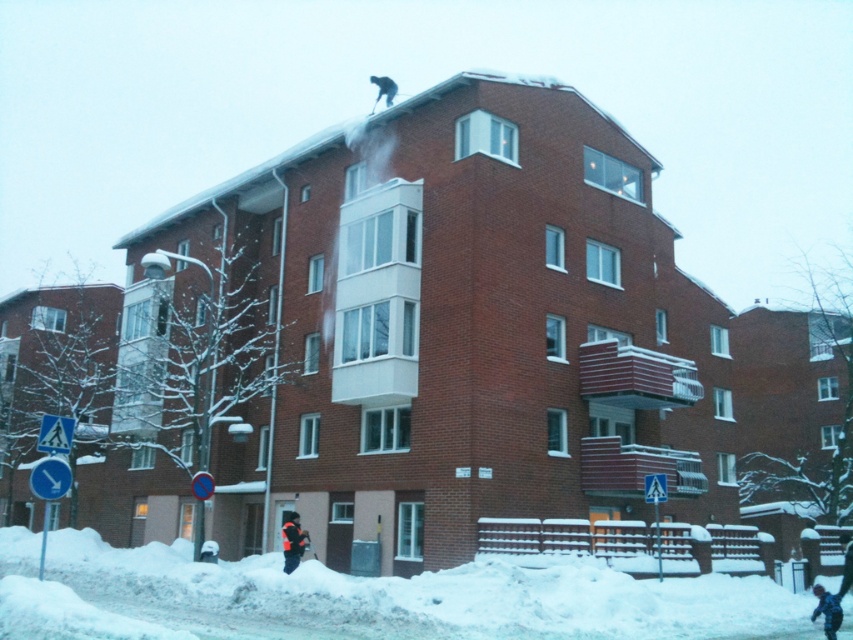
Is white plastic triangle at lower left further to the viewer compared to blue plastic pedestrian crossing sign at lower center?

That is False.

Can you confirm if white plastic triangle at lower left is wider than blue plastic pedestrian crossing sign at lower center?

Indeed, white plastic triangle at lower left has a greater width compared to blue plastic pedestrian crossing sign at lower center.

Is point (51, 445) farther from viewer compared to point (659, 577)?

No, it is in front of (659, 577).

The height and width of the screenshot is (640, 853). Identify the location of white plastic triangle at lower left. (55, 433).

Can you confirm if orange fleece jacket at upper center is smaller than blue plastic pedestrian crossing sign at lower center?

Yes, orange fleece jacket at upper center is smaller than blue plastic pedestrian crossing sign at lower center.

How far apart are orange fleece jacket at upper center and blue plastic pedestrian crossing sign at lower center?

A distance of 16.61 meters exists between orange fleece jacket at upper center and blue plastic pedestrian crossing sign at lower center.

Who is more forward, (289, 531) or (654, 520)?

Positioned in front is point (289, 531).

This screenshot has height=640, width=853. Find the location of `orange fleece jacket at upper center`. orange fleece jacket at upper center is located at coordinates (292, 541).

Can you confirm if white fluffy snow at lower center is shorter than blue fabric jacket at lower right?

In fact, white fluffy snow at lower center may be taller than blue fabric jacket at lower right.

Which of these two, white fluffy snow at lower center or blue fabric jacket at lower right, stands taller?

white fluffy snow at lower center

Is point (564, 563) more distant than point (836, 593)?

No, it is not.

Locate an element on the screen. This screenshot has width=853, height=640. white fluffy snow at lower center is located at coordinates (367, 596).